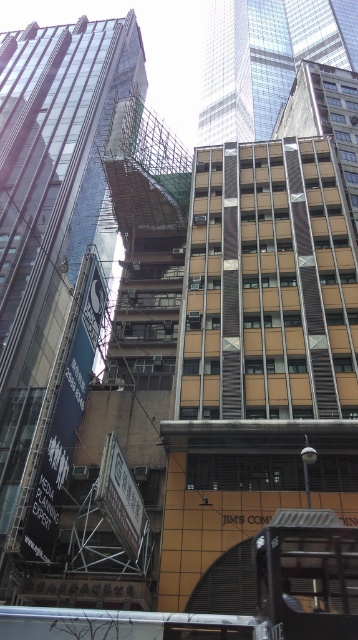
Is point (73, 122) positioned before point (273, 24)?

Yes, point (73, 122) is in front of point (273, 24).

Can you confirm if brown textured building at center is positioned above glassy steel skyscraper at upper center?

No.

Is point (28, 337) closer to viewer compared to point (215, 40)?

That is True.

Identify the location of brown textured building at center. (52, 256).